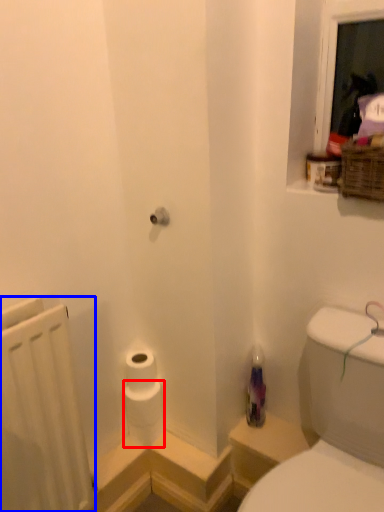
Question: Which object is further to the camera taking this photo, toilet paper (highlighted by a red box) or radiator (highlighted by a blue box)?

Choices:
 (A) toilet paper
 (B) radiator

Answer: (A)